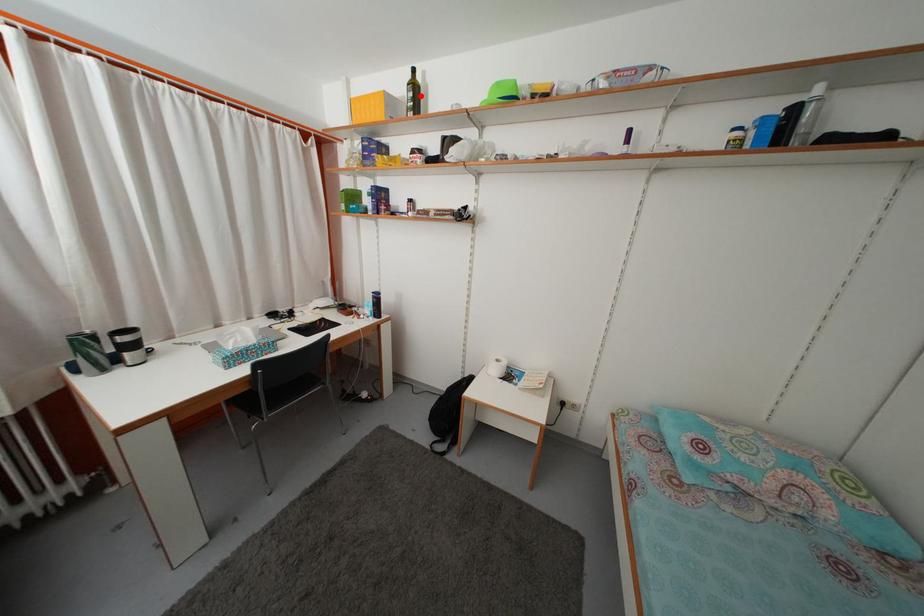
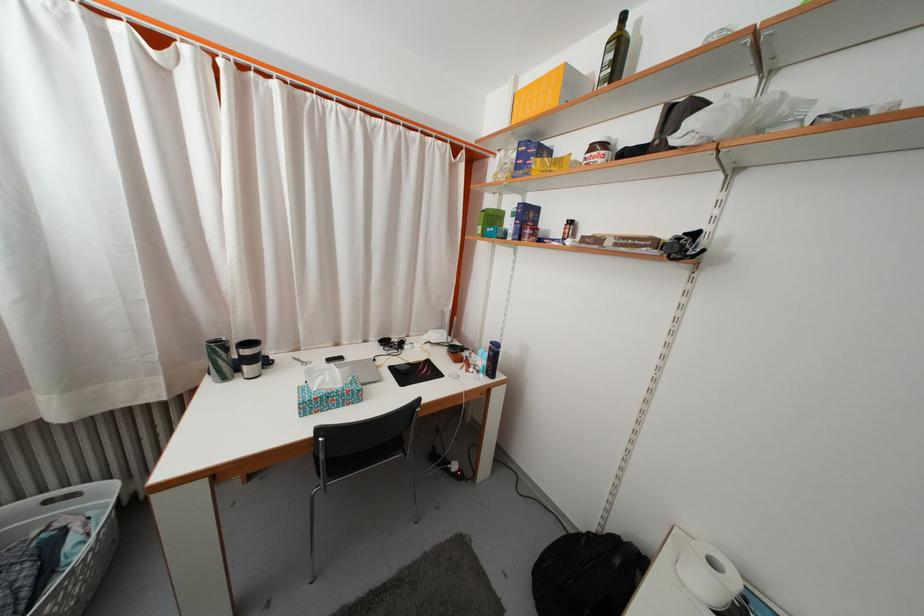
Question: I am providing you with two images of the same scene from different viewpoints. A red point is marked on the first image. Is the red point's position out of view in image 2?

Choices:
 (A) Yes
 (B) No

Answer: (B)